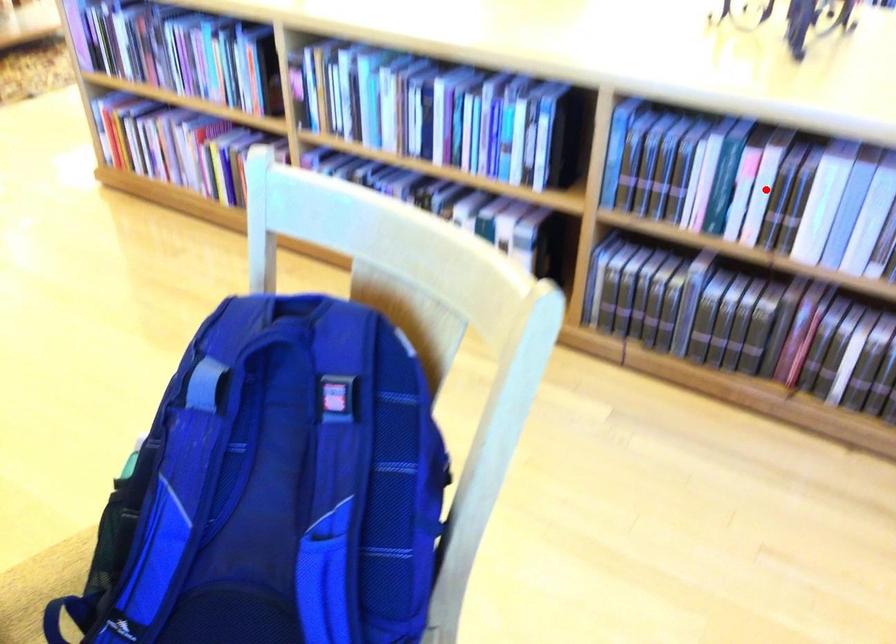
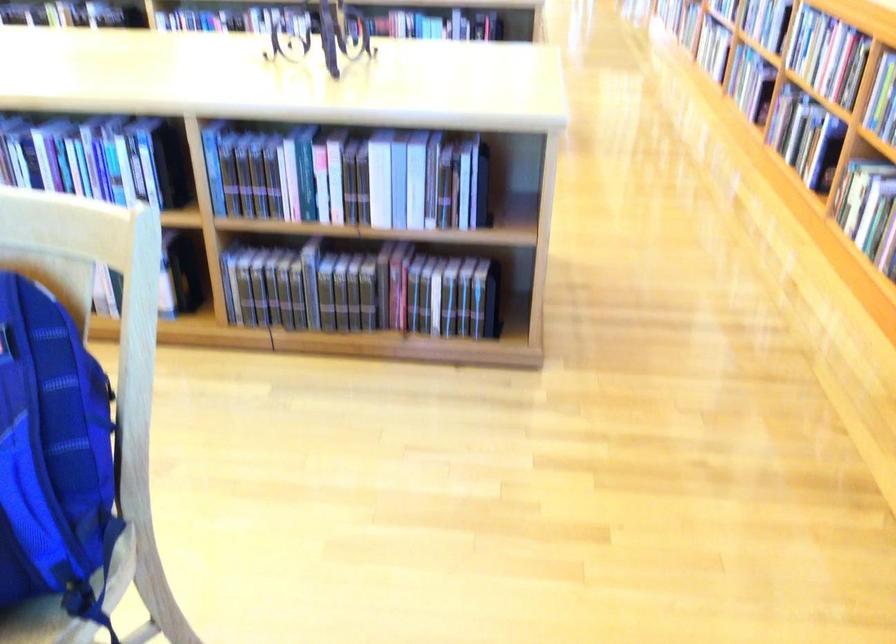
Where in the second image is the point corresponding to the highlighted location from the first image?

(334, 176)